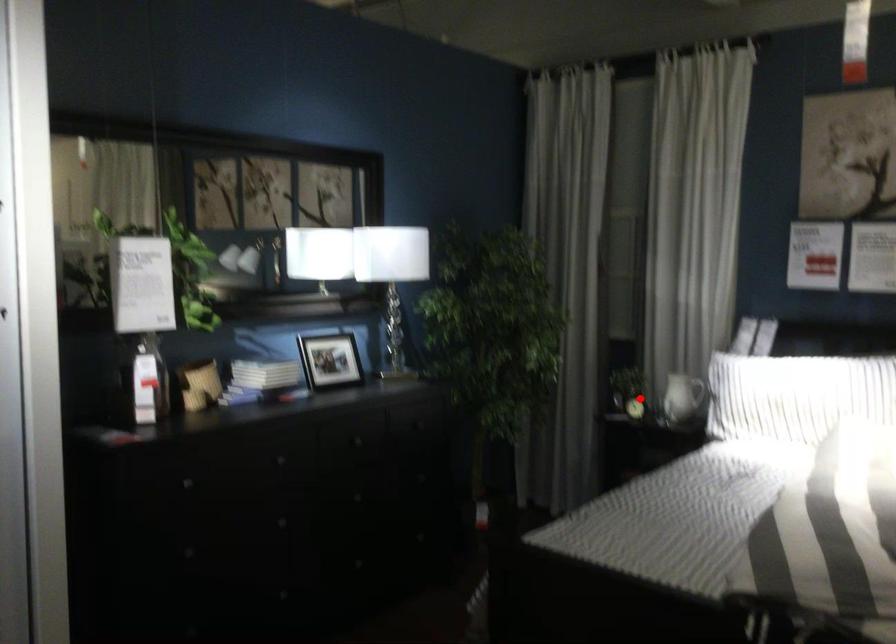
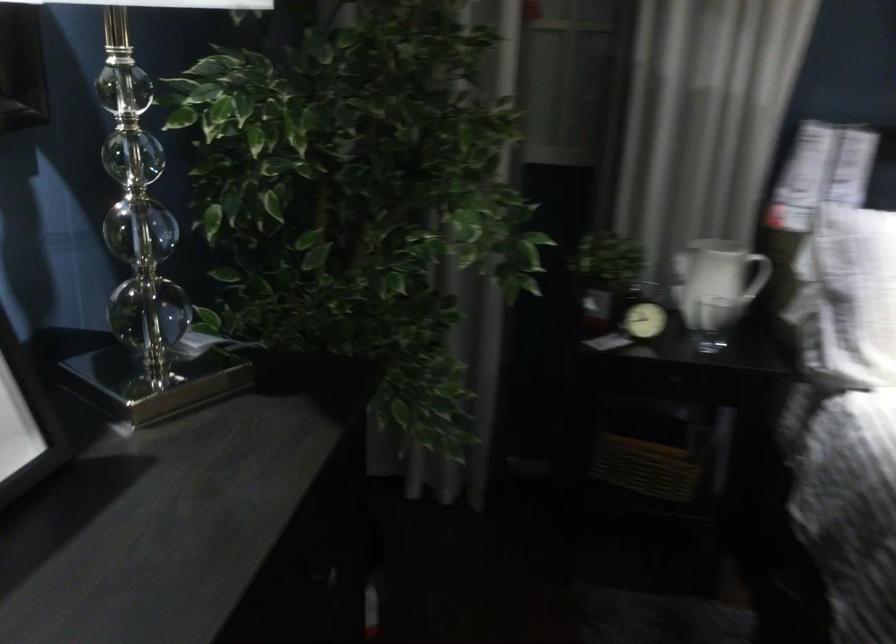
Question: I am providing you with two images of the same scene from different viewpoints. Given a red point in image1, look at the same physical point in image2. Is it:

Choices:
 (A) Closer to the viewpoint
 (B) Farther from the viewpoint

Answer: (A)